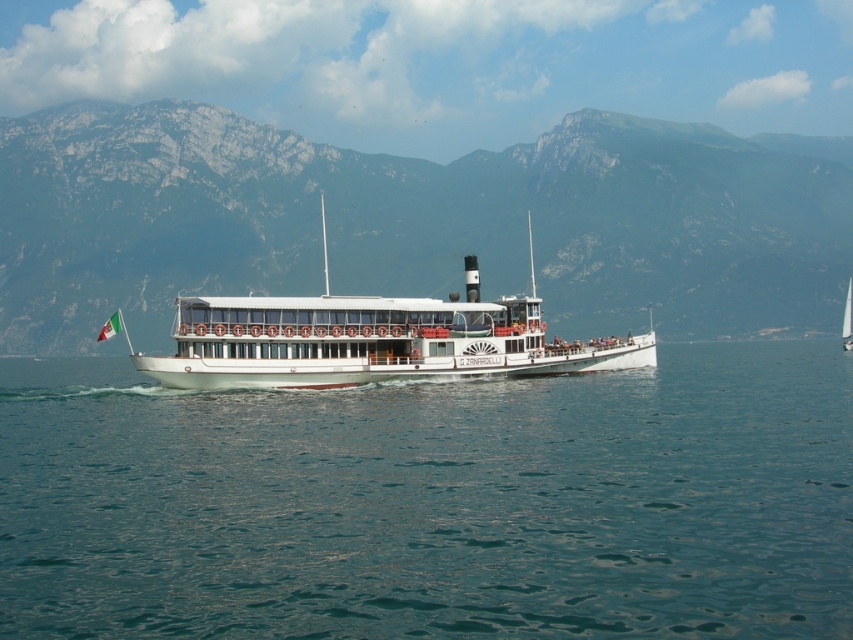
Question: Does green rocky mountain at center have a larger size compared to white polished wood boat at center?

Choices:
 (A) yes
 (B) no

Answer: (A)

Question: Which of the following is the farthest from the observer?

Choices:
 (A) clear blue water at center
 (B) white polished wood boat at center
 (C) green rocky mountain at center

Answer: (C)

Question: Does clear blue water at center have a smaller size compared to green rocky mountain at center?

Choices:
 (A) no
 (B) yes

Answer: (B)

Question: Which point is farther to the camera?

Choices:
 (A) white polished wood boat at center
 (B) clear blue water at center
 (C) green rocky mountain at center

Answer: (C)

Question: Is green rocky mountain at center further to camera compared to white polished wood boat at center?

Choices:
 (A) no
 (B) yes

Answer: (B)

Question: Which point is closer to the camera?

Choices:
 (A) (799, 390)
 (B) (343, 360)
 (C) (173, 280)

Answer: (B)